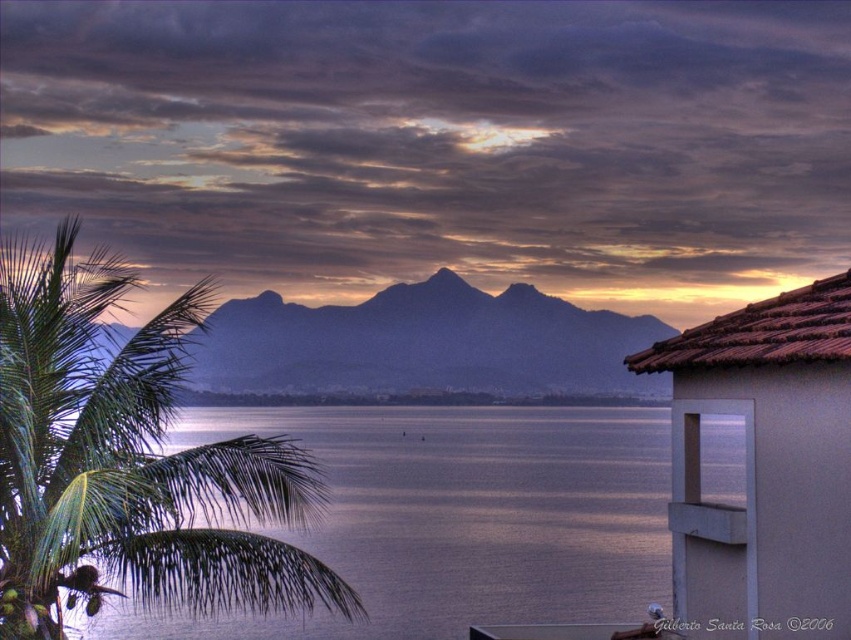
You are standing on the beach and notice the green leafy palm tree at left and the smokey gray mountain at center. Which object appears narrower when viewed from your current position?

The green leafy palm tree at left appears narrower than the smokey gray mountain at center because it has a lesser width compared to the mountain.

You are standing on the beach and see the green leafy palm tree at left and the smokey gray mountain at center. Which object is closer to your left side?

The green leafy palm tree at left is closer to your left side because it is positioned to the left of the smokey gray mountain at center.